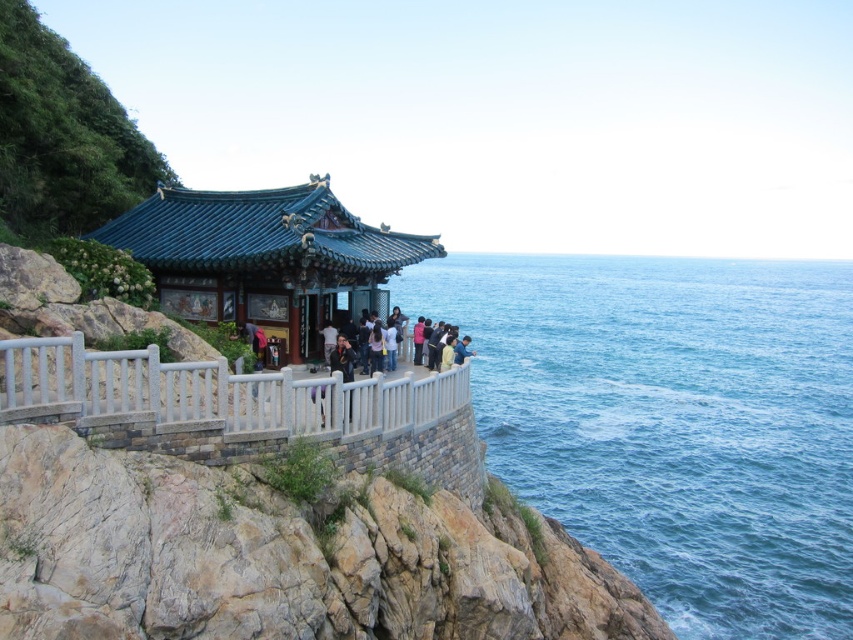
You are standing at the cliff edge near the green glazed tile gazebo at center and want to look at the blue water at center. Which object is higher in elevation?

The blue water at center has a greater height compared to the green glazed tile gazebo at center, so the blue water at center is higher in elevation.

You are a tour guide leading a group to the cliff edge. You want to ensure everyone stays safe. There are two points marked in the scene. The first point is at coordinate point(752, 376) and the second is at point(331, 364). Which point is closer to the cliff edge?

Point(331, 364) is closer to the cliff edge because it is in front of point(752, 376).